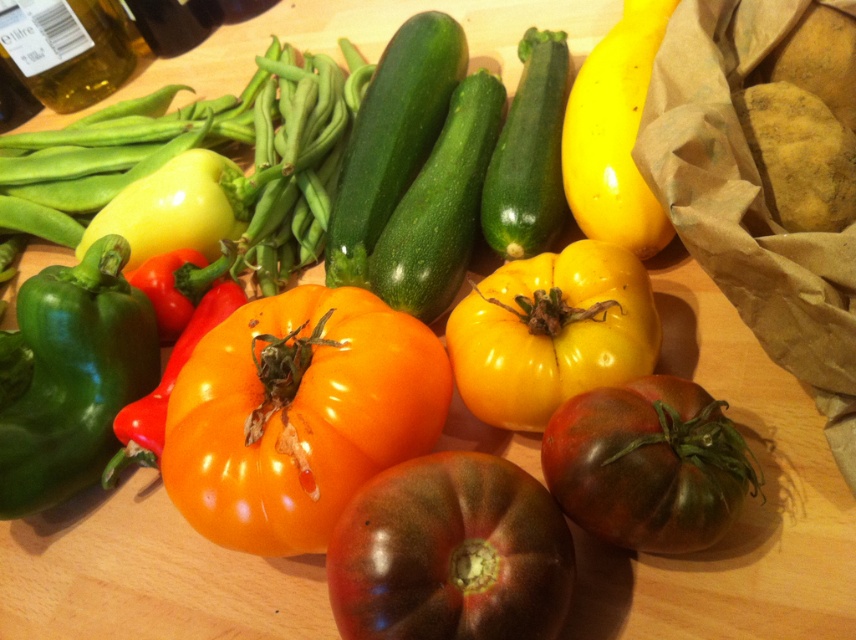
Can you confirm if shiny orange tomato at center is positioned below dark red matte tomato at center?

Incorrect, shiny orange tomato at center is not positioned below dark red matte tomato at center.

Where is `shiny orange tomato at center`? This screenshot has height=640, width=856. shiny orange tomato at center is located at coordinates (298, 413).

The image size is (856, 640). In order to click on shiny orange tomato at center in this screenshot , I will do `click(298, 413)`.

Is yellow matte tomato at center below yellow smooth pepper at upper right?

Yes, yellow matte tomato at center is below yellow smooth pepper at upper right.

Does yellow matte tomato at center appear on the left side of yellow smooth pepper at upper right?

Indeed, yellow matte tomato at center is positioned on the left side of yellow smooth pepper at upper right.

Which is behind, point (490, 317) or point (628, 198)?

The point (628, 198) is more distant.

Find the location of a particular element. The image size is (856, 640). yellow matte tomato at center is located at coordinates (551, 332).

Measure the distance from yellow matte tomato at center to dark green matte tomato at center.

yellow matte tomato at center is 4.74 inches away from dark green matte tomato at center.

Is yellow matte tomato at center thinner than dark green matte tomato at center?

No.

Is point (649, 323) positioned in front of point (615, 445)?

That is False.

Identify the location of yellow matte tomato at center. (551, 332).